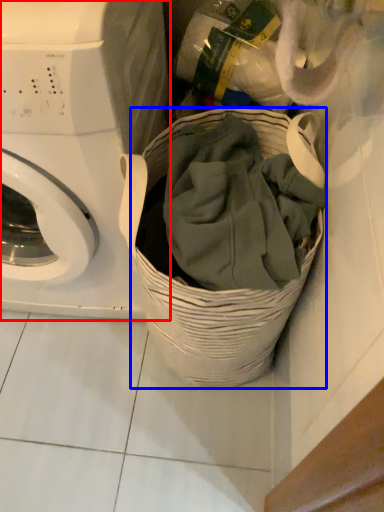
Question: Which of the following is the farthest to the observer, washing machine (highlighted by a red box) or basket (highlighted by a blue box)?

Choices:
 (A) washing machine
 (B) basket

Answer: (B)